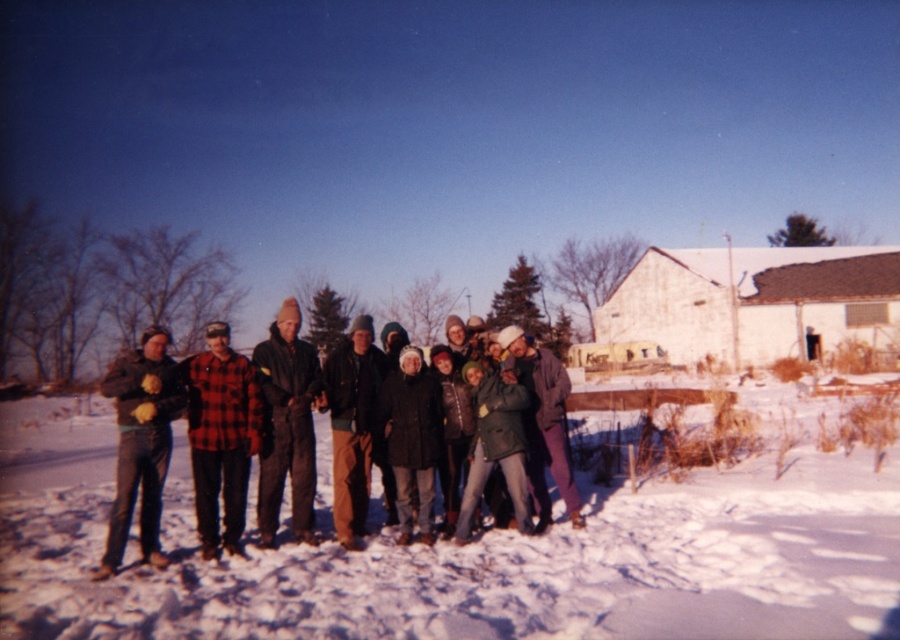
You are organizing a winter photo shoot and need to ensure that the red plaid shirt at center and the dark gray woolen jacket at left are visible in the frame. Based on their sizes, which clothing item would you focus on first to ensure both are fully visible?

The red plaid shirt at center is smaller in size compared to the dark gray woolen jacket at left. To ensure both are fully visible, focus on positioning the camera to capture the smaller red plaid shirt at center first, then adjust the frame to include the larger dark gray woolen jacket at left.